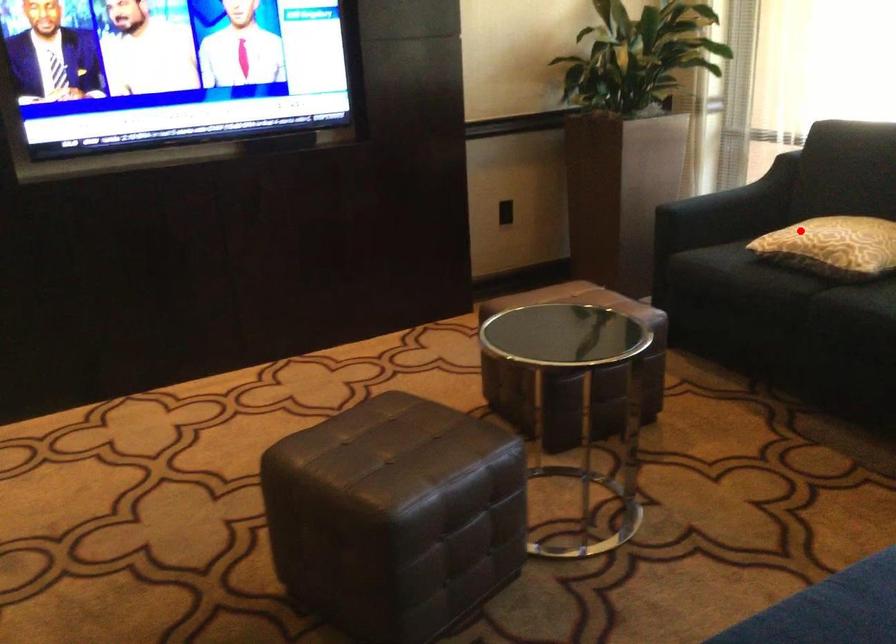
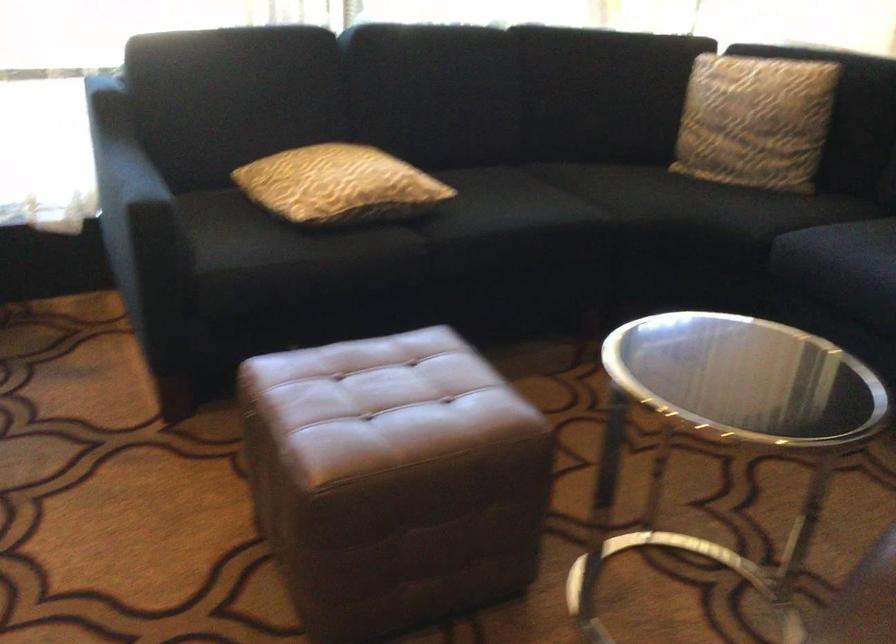
Find the pixel in the second image that matches the highlighted location in the first image.

(339, 185)